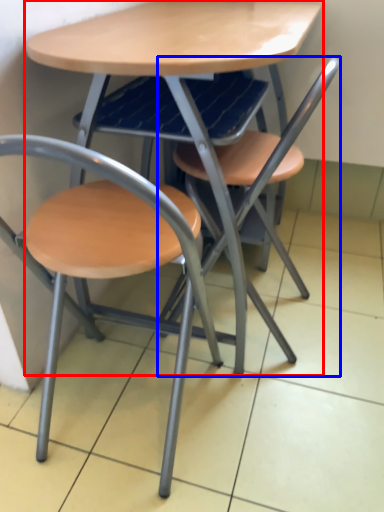
Question: Which object appears closest to the camera in this image, table (highlighted by a red box) or chair (highlighted by a blue box)?

Choices:
 (A) table
 (B) chair

Answer: (A)